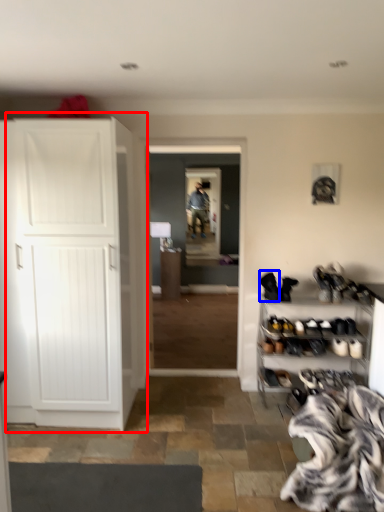
Question: Which object appears closest to the camera in this image, cupboard (highlighted by a red box) or footwear (highlighted by a blue box)?

Choices:
 (A) cupboard
 (B) footwear

Answer: (A)